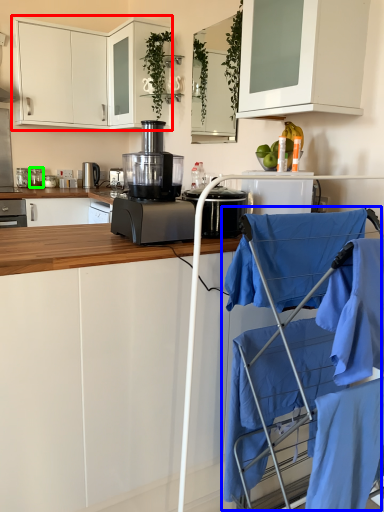
Question: Estimate the real-world distances between objects in this image. Which object is farther from cabinetry (highlighted by a red box), baby carriage (highlighted by a blue box) or kitchen appliance (highlighted by a green box)?

Choices:
 (A) baby carriage
 (B) kitchen appliance

Answer: (A)